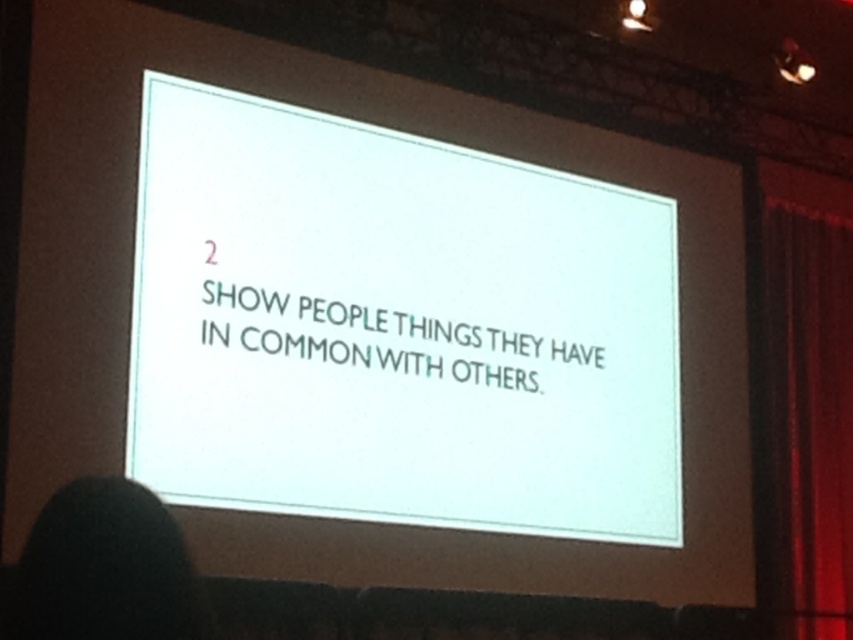
You are sitting in the front row of the conference hall and want to focus on two points on the projected slide. The first point is at coordinate point (560, 472) and the second is at coordinate point (817, 280). Which point will appear larger to you?

Point (560, 472) is closer to the camera than point (817, 280), so it will appear larger to you.

You are an event organizer setting up for a presentation. You notice the red velvet curtain at right and the black hair at lower left in the image. Which object is taller?

The red velvet curtain at right is taller than the black hair at lower left.

You are an event organizer who needs to ensure the white paper at center and red velvet curtain at right are visible to all attendees. Considering the current setup, which object might block the view of the other if positioned incorrectly?

The red velvet curtain at right might block the view of the white paper at center if it is too close, since the white paper at center is wider than the red velvet curtain at right and could extend beyond its position.